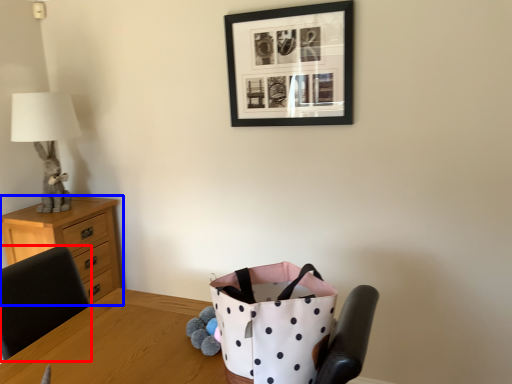
Question: Among these objects, which one is farthest to the camera, chair (highlighted by a red box) or chest of drawers (highlighted by a blue box)?

Choices:
 (A) chair
 (B) chest of drawers

Answer: (B)